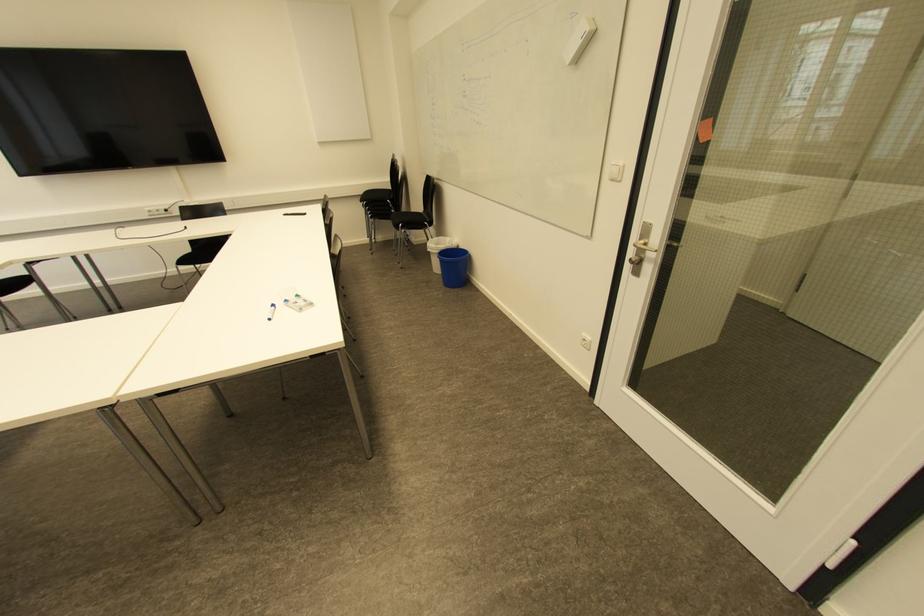
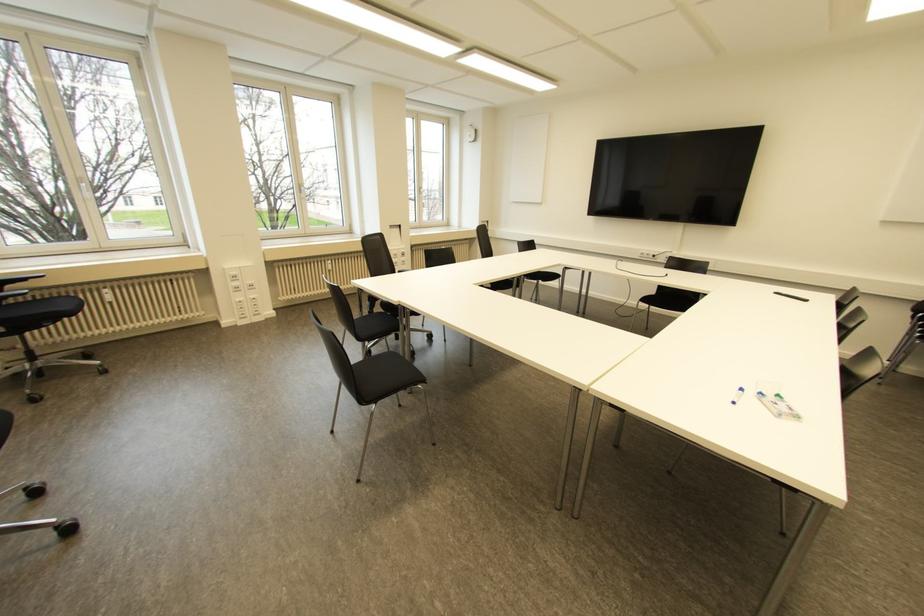
Where in the second image is the point corresponding to (x=297, y=294) from the first image?

(777, 395)